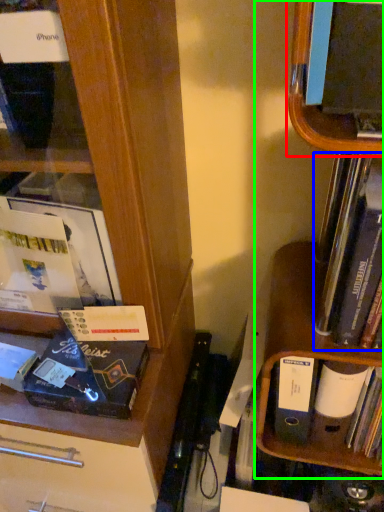
Question: Considering the real-world distances, which object is closest to shelf (highlighted by a red box)? book (highlighted by a blue box) or shelf (highlighted by a green box).

Choices:
 (A) book
 (B) shelf

Answer: (A)